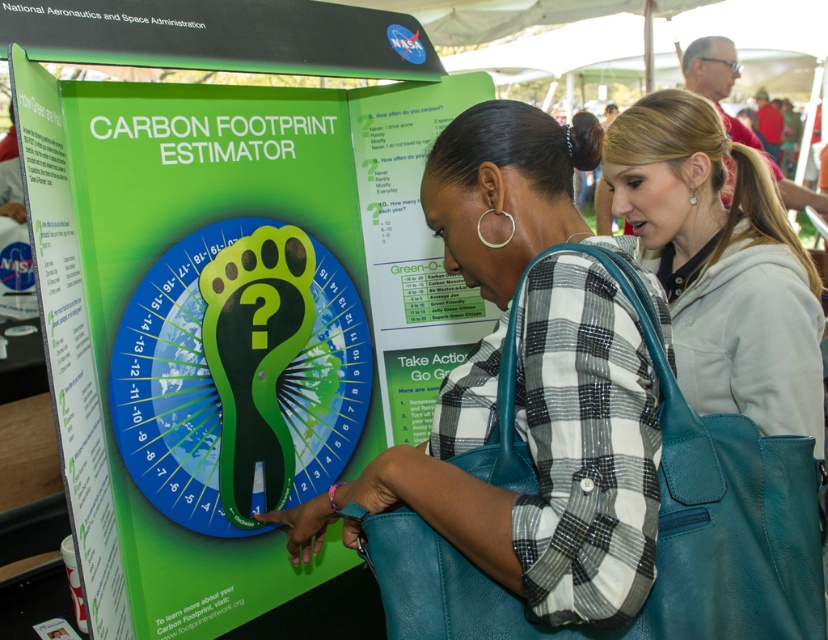
Is green plastic carbon footprint estimator at center smaller than light gray hoodie at center?

Actually, green plastic carbon footprint estimator at center might be larger than light gray hoodie at center.

You are a GUI agent. You are given a task and a screenshot of the screen. Output one action in this format:
    pyautogui.click(x=<x>, y=<y>)
    Task: Click on the green plastic carbon footprint estimator at center
    
    Given the screenshot: What is the action you would take?
    pyautogui.click(x=219, y=316)

Locate an element on the screen. This screenshot has height=640, width=828. green plastic carbon footprint estimator at center is located at coordinates (219, 316).

Based on the photo, is teal leather handbag at center thinner than light gray hoodie at center?

Incorrect, teal leather handbag at center's width is not less than light gray hoodie at center's.

Which of these two, teal leather handbag at center or light gray hoodie at center, stands shorter?

teal leather handbag at center

Locate an element on the screen. This screenshot has height=640, width=828. teal leather handbag at center is located at coordinates (537, 456).

Between point (186, 268) and point (619, 362), which one is positioned in front?

Positioned in front is point (619, 362).

Does green plastic carbon footprint estimator at center have a greater width compared to teal leather handbag at center?

Indeed, green plastic carbon footprint estimator at center has a greater width compared to teal leather handbag at center.

Locate an element on the screen. Image resolution: width=828 pixels, height=640 pixels. green plastic carbon footprint estimator at center is located at coordinates tap(219, 316).

Find the location of a particular element. The image size is (828, 640). green plastic carbon footprint estimator at center is located at coordinates (219, 316).